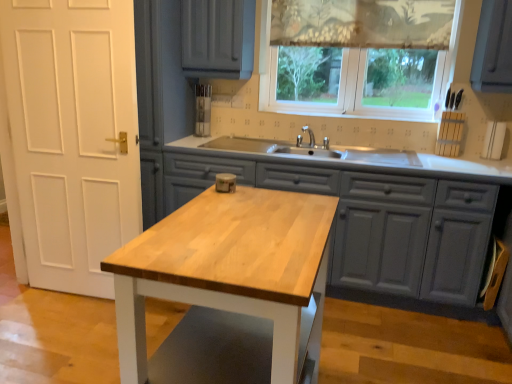
Question: Is the position of translucent fabric at upper center more distant than that of patterned fabric curtain at upper center?

Choices:
 (A) no
 (B) yes

Answer: (A)

Question: Is translucent fabric at upper center to the left of patterned fabric curtain at upper center from the viewer's perspective?

Choices:
 (A) yes
 (B) no

Answer: (A)

Question: Considering the relative sizes of translucent fabric at upper center and patterned fabric curtain at upper center in the image provided, is translucent fabric at upper center taller than patterned fabric curtain at upper center?

Choices:
 (A) no
 (B) yes

Answer: (B)

Question: Can patterned fabric curtain at upper center be found inside translucent fabric at upper center?

Choices:
 (A) no
 (B) yes

Answer: (B)

Question: Is translucent fabric at upper center turned away from patterned fabric curtain at upper center?

Choices:
 (A) yes
 (B) no

Answer: (A)

Question: From the image's perspective, is light wood table at center above or below wooden island at center?

Choices:
 (A) below
 (B) above

Answer: (A)

Question: Considering the relative positions of light wood table at center and wooden island at center in the image provided, is light wood table at center to the left or to the right of wooden island at center?

Choices:
 (A) right
 (B) left

Answer: (B)

Question: Would you say light wood table at center is inside or outside wooden island at center?

Choices:
 (A) outside
 (B) inside

Answer: (A)

Question: From a real-world perspective, is light wood table at center above or below wooden island at center?

Choices:
 (A) below
 (B) above

Answer: (B)

Question: Is patterned fabric curtain at upper center taller or shorter than translucent fabric at upper center?

Choices:
 (A) short
 (B) tall

Answer: (A)

Question: In terms of size, does patterned fabric curtain at upper center appear bigger or smaller than translucent fabric at upper center?

Choices:
 (A) big
 (B) small

Answer: (B)

Question: Looking at their shapes, would you say patterned fabric curtain at upper center is wider or thinner than translucent fabric at upper center?

Choices:
 (A) wide
 (B) thin

Answer: (B)

Question: Do you think patterned fabric curtain at upper center is within translucent fabric at upper center, or outside of it?

Choices:
 (A) inside
 (B) outside

Answer: (A)

Question: Based on their positions, is wooden island at center located to the left or right of patterned fabric curtain at upper center?

Choices:
 (A) right
 (B) left

Answer: (B)

Question: Is wooden island at center in front of or behind patterned fabric curtain at upper center in the image?

Choices:
 (A) front
 (B) behind

Answer: (A)